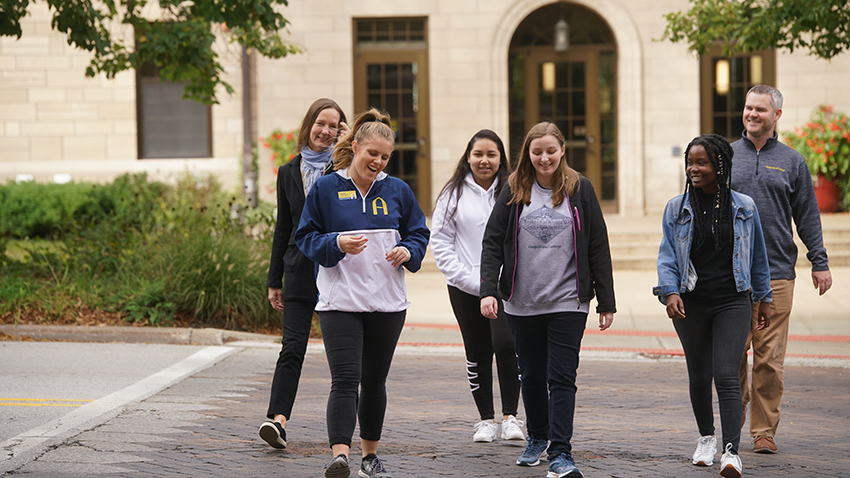
Locate an element on the screen. This screenshot has width=850, height=478. door is located at coordinates (388, 83), (567, 93).